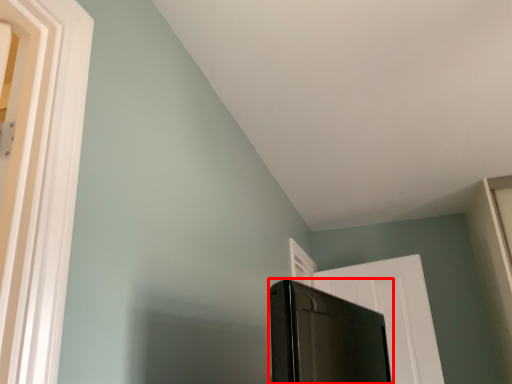
Question: From the image's perspective, considering the relative positions of screen door (annotated by the red box) and door in the image provided, where is screen door (annotated by the red box) located with respect to the staircase?

Choices:
 (A) above
 (B) below

Answer: (A)